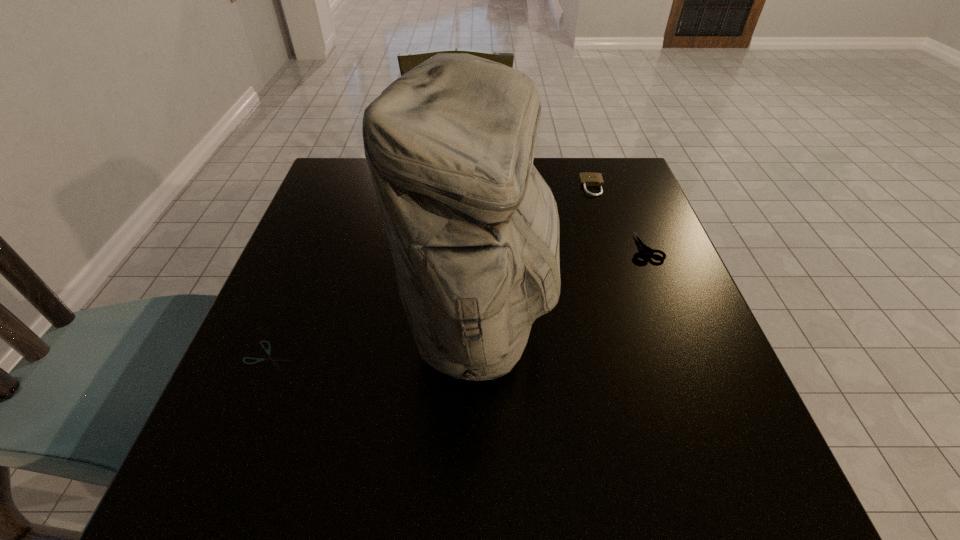
You are a GUI agent. You are given a task and a screenshot of the screen. Output one action in this format:
    pyautogui.click(x=<x>, y=<y>)
    Task: Click on the vacant space situated 0.180m on the front of the rightmost object
    
    Given the screenshot: What is the action you would take?
    click(x=678, y=329)

Locate an element on the screen. Image resolution: width=960 pixels, height=540 pixels. free space located on the front of the shortest object is located at coordinates (246, 414).

What are the coordinates of `object that is positioned at the far edge` in the screenshot? It's located at (587, 178).

Image resolution: width=960 pixels, height=540 pixels. I want to click on object located at the left edge, so click(x=270, y=358).

Identify the location of padlock that is at the right edge. Image resolution: width=960 pixels, height=540 pixels. (587, 178).

Identify the location of shears at the right edge. (644, 249).

Locate an element on the screen. Image resolution: width=960 pixels, height=540 pixels. object at the far right corner is located at coordinates (587, 178).

Find the location of a particular element. The image size is (960, 540). vacant space at the near edge of the desktop is located at coordinates (430, 467).

The image size is (960, 540). Find the location of `vacant space at the left edge of the desktop`. vacant space at the left edge of the desktop is located at coordinates (342, 300).

Image resolution: width=960 pixels, height=540 pixels. In the image, there is a desktop. Find the location of `free space at the right edge`. free space at the right edge is located at coordinates (708, 423).